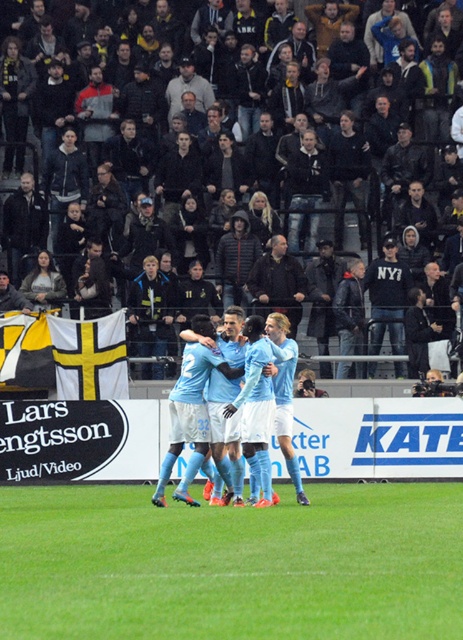
You are a photographer at the soccer match. You want to capture a photo that includes both the green grass at center and the light blue jersey at center. Based on their positions, which object should appear closer to the camera in the photo?

The green grass at center is in front of the light blue jersey at center, so it will appear closer to the camera in the photo.

You are a photographer at the soccer match and want to capture a photo of the green grass at center and the dark gray hoodies at center. Which object is shorter in the image?

The green grass at center has a lesser height compared to dark gray hoodies at center, so the green grass at center is shorter.